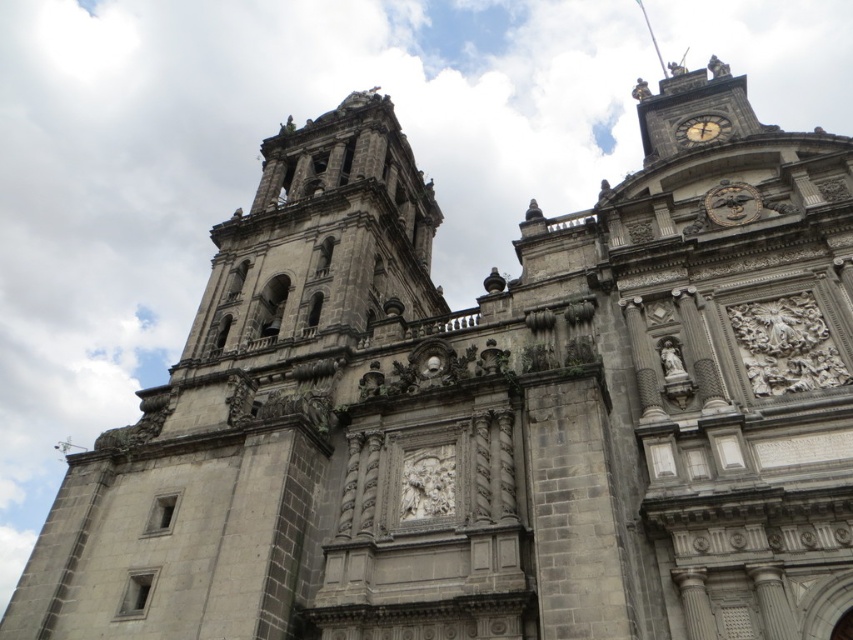
Does gold metallic clock at upper center have a lesser width compared to golden metallic clock at upper right?

Indeed, gold metallic clock at upper center has a lesser width compared to golden metallic clock at upper right.

Between gold metallic clock at upper center and golden metallic clock at upper right, which one appears on the left side from the viewer's perspective?

gold metallic clock at upper center

Find the location of a particular element. The image size is (853, 640). gold metallic clock at upper center is located at coordinates [x=732, y=204].